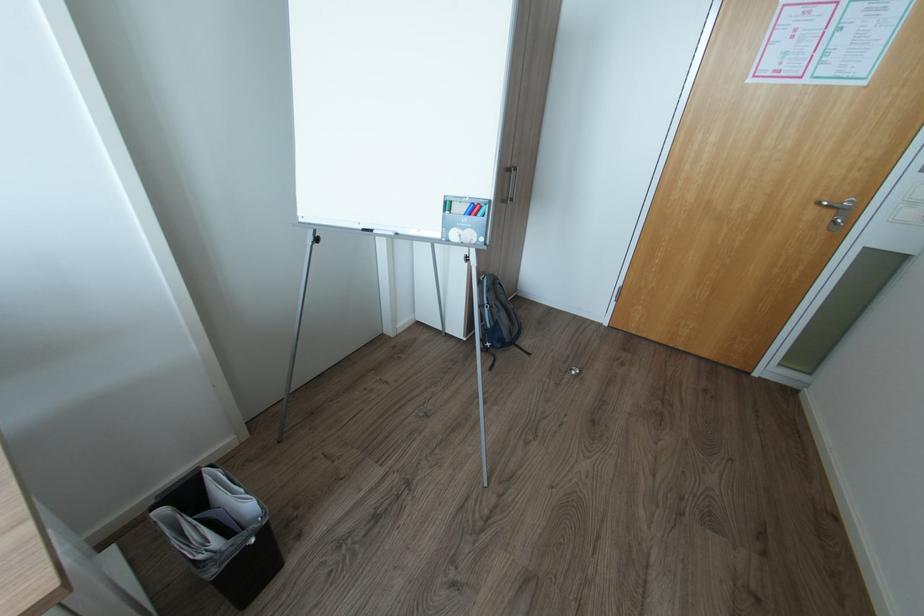
Describe the element at coordinates (836, 204) in the screenshot. I see `the silver door handle` at that location.